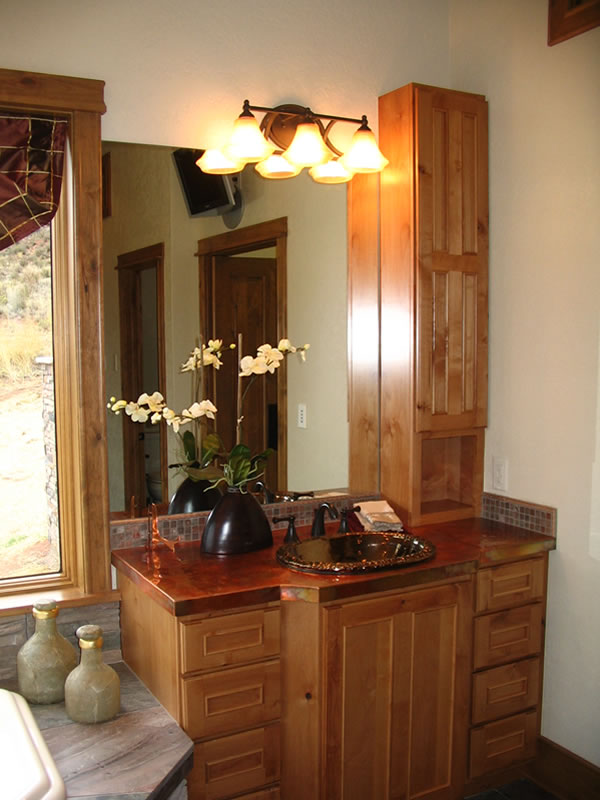
Locate an element on the screen. The height and width of the screenshot is (800, 600). faucet is located at coordinates (316, 514).